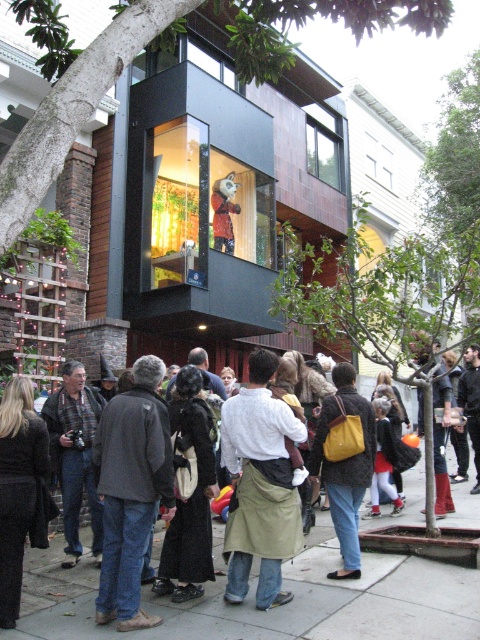
Based on the photo, which is more to the left, khaki fabric apron at center or dark gray jacket at center?

Positioned to the left is dark gray jacket at center.

Is point (257, 532) closer to viewer compared to point (144, 465)?

No, it is behind (144, 465).

This screenshot has width=480, height=640. Describe the element at coordinates (260, 484) in the screenshot. I see `khaki fabric apron at center` at that location.

The image size is (480, 640). In order to click on khaki fabric apron at center in this screenshot , I will do `click(260, 484)`.

Measure the distance between concrete sidewalk at center and matte yellow backpack at center.

concrete sidewalk at center and matte yellow backpack at center are 35.54 inches apart from each other.

Who is shorter, concrete sidewalk at center or matte yellow backpack at center?

concrete sidewalk at center is shorter.

Looking at this image, measure the distance between point (303, 580) and camera.

A distance of 5.53 meters exists between point (303, 580) and camera.

This screenshot has height=640, width=480. Identify the location of concrete sidewalk at center. (274, 609).

Where is `dark gray jacket at center`? This screenshot has height=640, width=480. dark gray jacket at center is located at coordinates (132, 490).

The width and height of the screenshot is (480, 640). I want to click on dark gray jacket at center, so click(x=132, y=490).